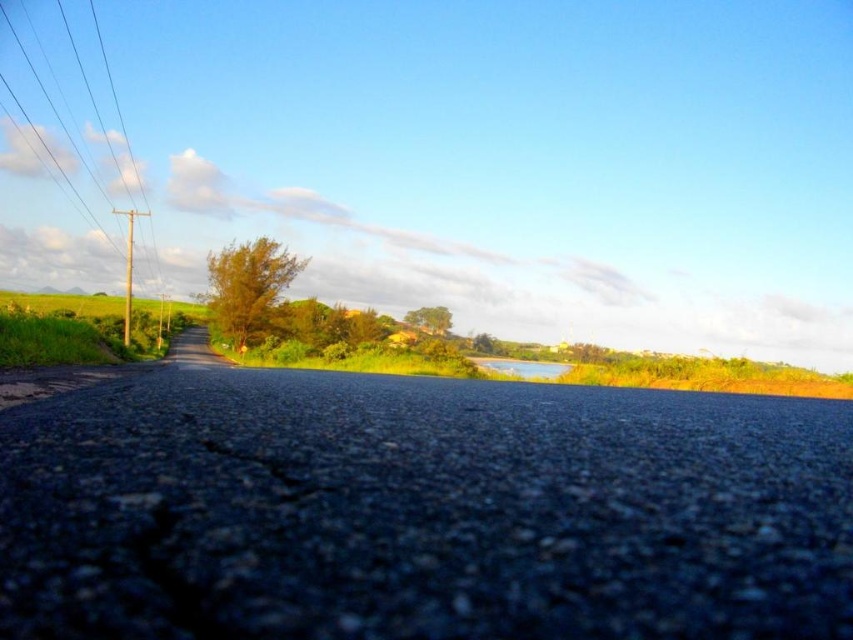
You are standing at the starting point of the road and want to place a new utility pole exactly at the same 2D location as the green leafy bush at center. What are the coordinates where you should place the new utility pole?

The coordinates for the green leafy bush at center are at point (248, 285), so you should place the new utility pole at those coordinates.

You are a gardener standing on the road and looking towards the green leafy bush at center and the dark asphalt crack at center. Which object is higher from the ground?

The green leafy bush at center is higher from the ground than the dark asphalt crack at center because it is positioned above it.